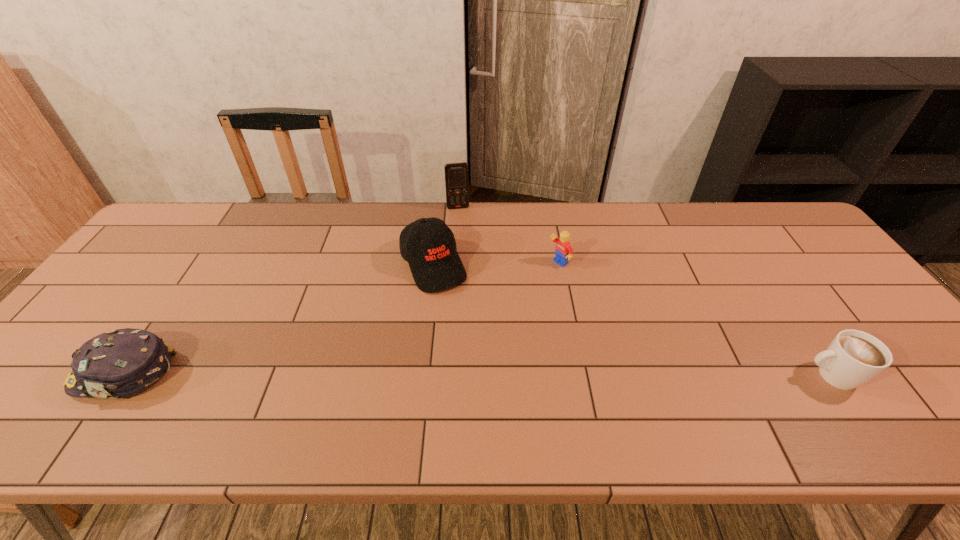
The width and height of the screenshot is (960, 540). I want to click on vacant region located on the screen of the farthest object, so click(x=463, y=226).

At what (x,y) coordinates should I click in order to perform the action: click on vacant position located 0.400m on the screen of the farthest object. Please return your answer as a coordinate pair (x, y). This screenshot has width=960, height=540. Looking at the image, I should click on (476, 295).

Where is `vacant area situated 0.310m on the screen of the farthest object`? The image size is (960, 540). vacant area situated 0.310m on the screen of the farthest object is located at coordinates (471, 273).

Find the location of a particular element. This screenshot has width=960, height=540. free spot located on the face of the fourth object from left to right is located at coordinates (447, 330).

I want to click on free point located on the face of the fourth object from left to right, so click(x=472, y=315).

Image resolution: width=960 pixels, height=540 pixels. Identify the location of free region located on the face of the fourth object from left to right. (525, 282).

Find the location of `vacant space located 0.300m on the front-facing side of the baseball cap`. vacant space located 0.300m on the front-facing side of the baseball cap is located at coordinates (496, 376).

Where is `free space located 0.060m on the front-facing side of the baseball cap`? free space located 0.060m on the front-facing side of the baseball cap is located at coordinates [455, 307].

Identify the location of free spot located 0.150m on the front-facing side of the baseball cap. (468, 330).

At what (x,y) coordinates should I click in order to perform the action: click on cellular telephone located in the far edge section of the desktop. Please return your answer as a coordinate pair (x, y). Looking at the image, I should click on (456, 174).